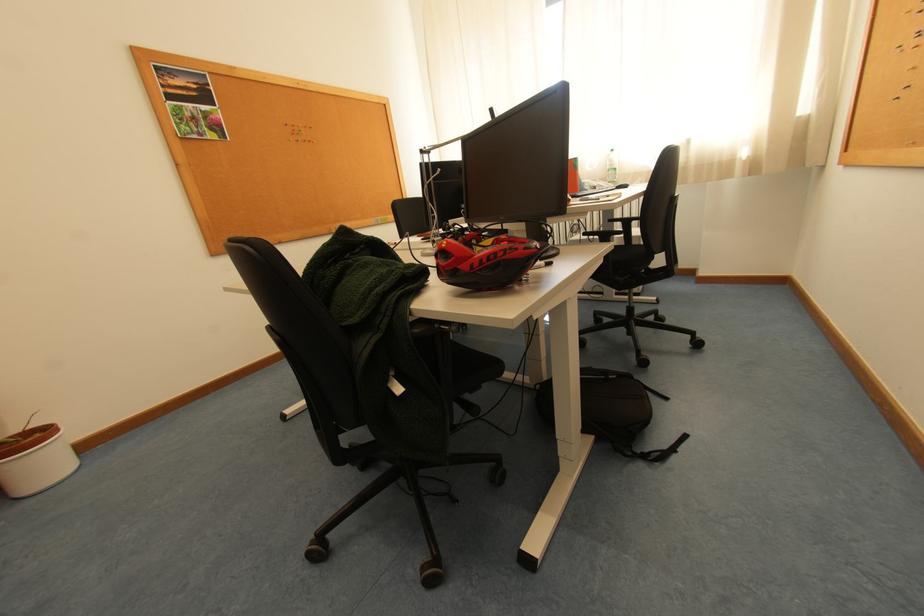
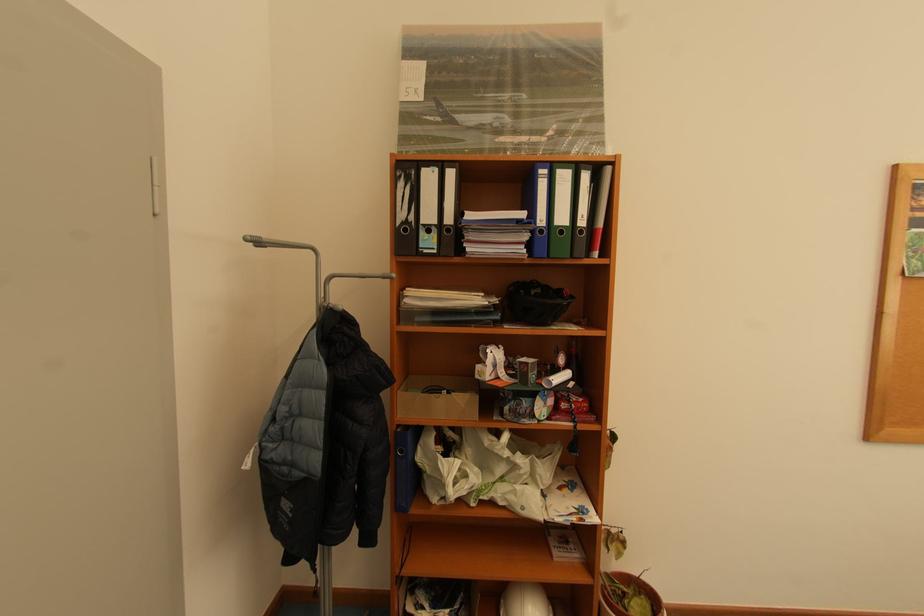
Locate, in the second image, the point that corresponds to pixel 140 49 in the first image.

(904, 167)